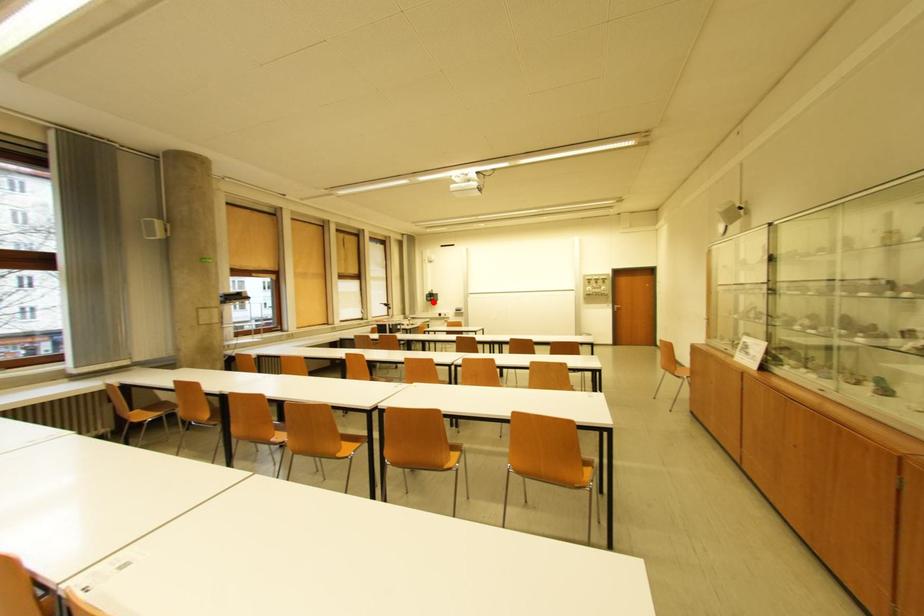
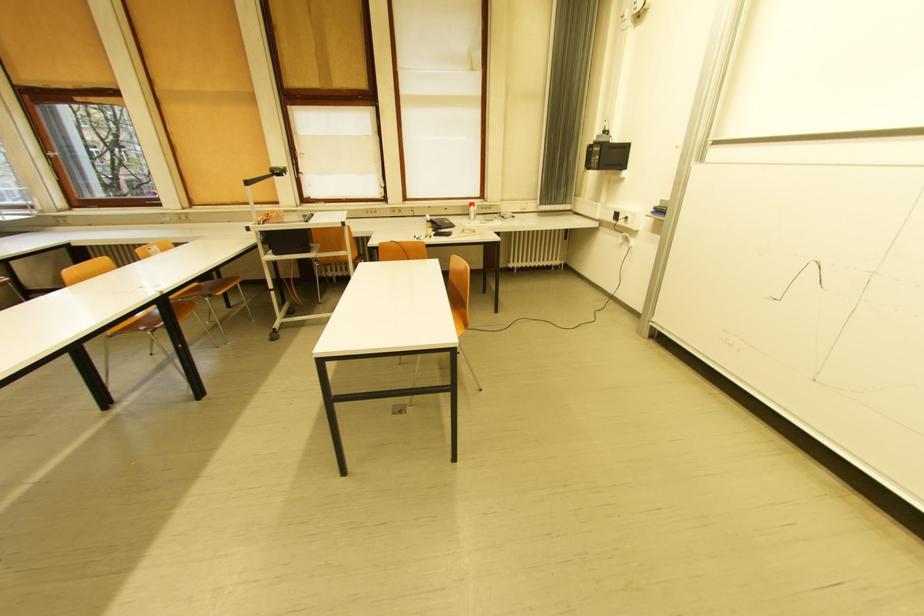
In the second image, find the point that corresponds to the highlighted location in the first image.

(592, 168)